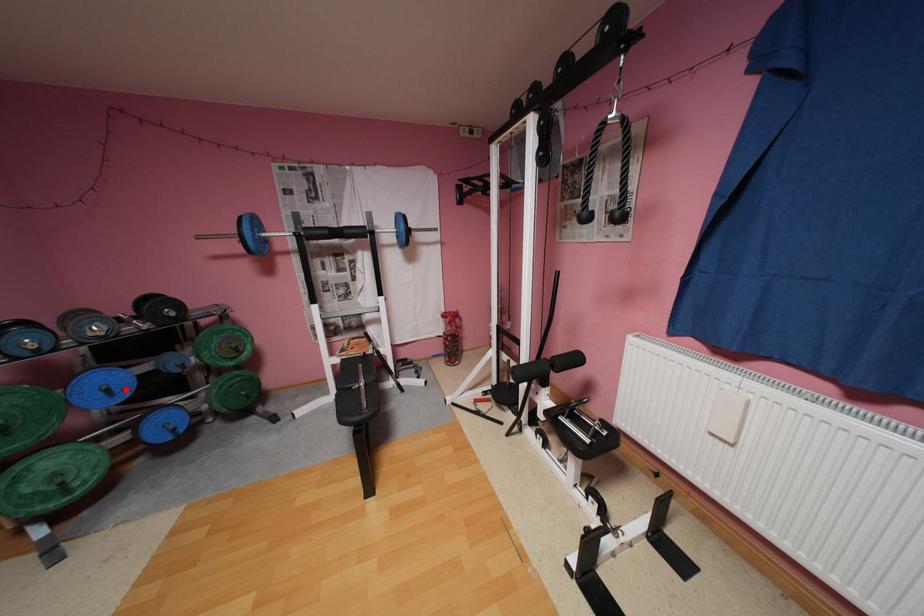
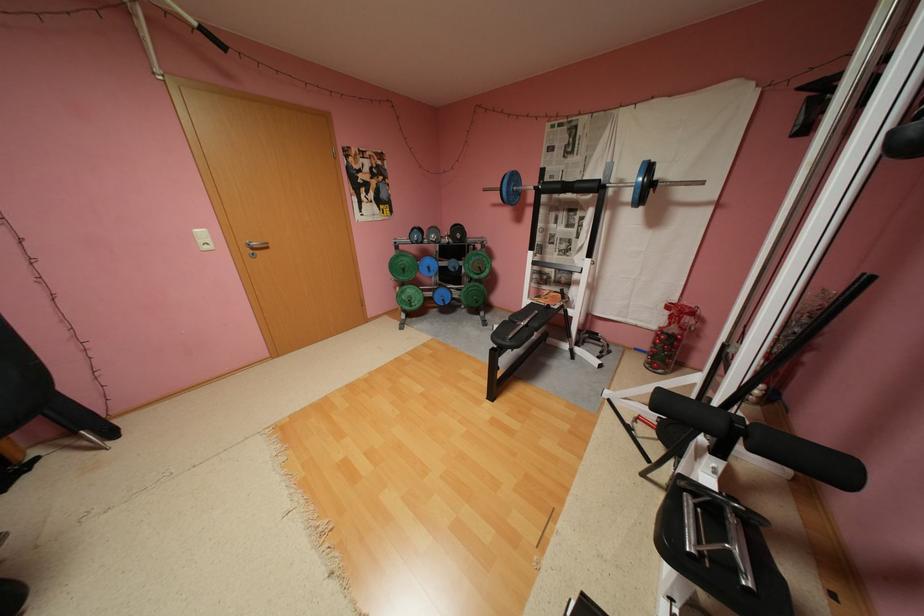
Question: I am providing you with two images of the same scene from different viewpoints. A red point is shown in image1. For the corresponding object point in image2, is it positioned nearer or farther from the camera?

Choices:
 (A) Nearer
 (B) Farther

Answer: (A)